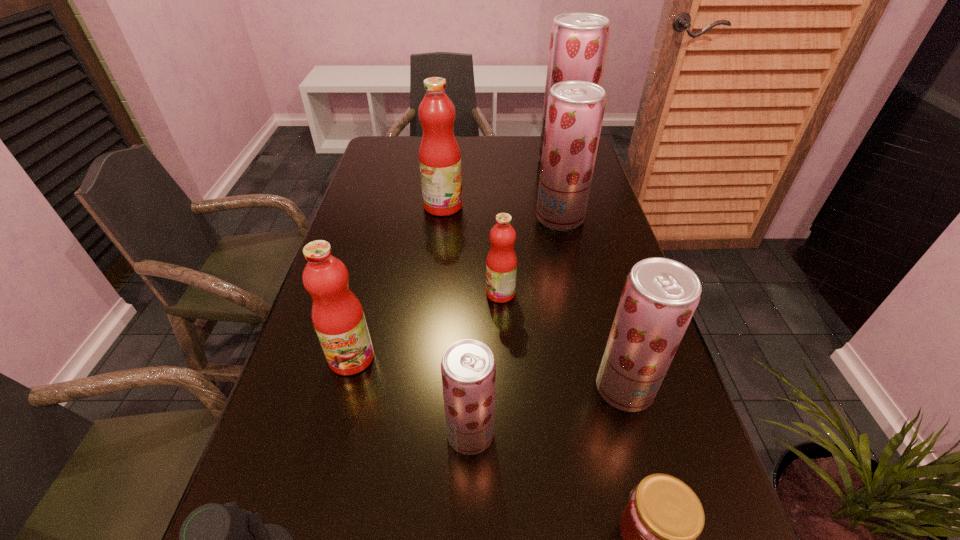
You are a GUI agent. You are given a task and a screenshot of the screen. Output one action in this format:
    pyautogui.click(x=<x>, y=<y>)
    Task: Click on the farthest fruit juice
    This screenshot has height=540, width=960.
    Given the screenshot: What is the action you would take?
    pyautogui.click(x=578, y=42)

Where is `the biggest strawberry fruit juice`? the biggest strawberry fruit juice is located at coordinates (578, 42).

Where is `the farthest pink fruit juice`? the farthest pink fruit juice is located at coordinates (439, 154).

Where is `the biggest pink fruit juice`? the biggest pink fruit juice is located at coordinates (439, 154).

I want to click on the second farthest strawberry fruit juice, so click(x=575, y=109).

Locate an element on the screen. This screenshot has width=960, height=540. the leftmost fruit juice is located at coordinates (338, 318).

In order to click on the nearest pink fruit juice in this screenshot , I will do `click(338, 318)`.

This screenshot has height=540, width=960. What are the coordinates of `the second smallest strawberry fruit juice` in the screenshot? It's located at (660, 295).

At what (x,y) coordinates should I click in order to perform the action: click on the sixth nearest object. Please return your answer as a coordinate pair (x, y). Looking at the image, I should click on (501, 263).

Locate an element on the screen. Image resolution: width=960 pixels, height=540 pixels. the fourth farthest fruit juice is located at coordinates (501, 263).